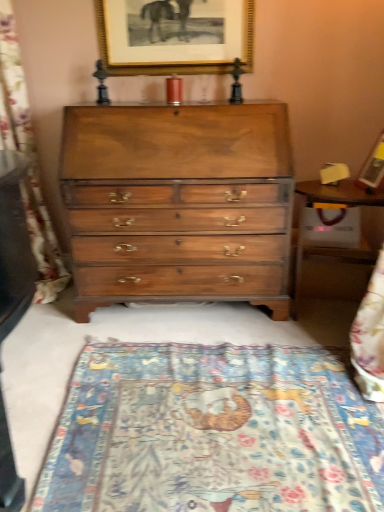
Question: Does wooden table at right appear on the left side of blue woven tapestry at left?

Choices:
 (A) yes
 (B) no

Answer: (B)

Question: Does wooden table at right have a lesser width compared to blue woven tapestry at left?

Choices:
 (A) no
 (B) yes

Answer: (B)

Question: Is wooden table at right taller than blue woven tapestry at left?

Choices:
 (A) no
 (B) yes

Answer: (A)

Question: From a real-world perspective, is wooden table at right located beneath blue woven tapestry at left?

Choices:
 (A) no
 (B) yes

Answer: (B)

Question: Considering the relative sizes of wooden table at right and blue woven tapestry at left in the image provided, is wooden table at right wider than blue woven tapestry at left?

Choices:
 (A) no
 (B) yes

Answer: (A)

Question: Based on their positions, is gold-framed picture at upper center, the first picture frame positioned from the left, located to the left or right of shiny brown wood chest of drawers at center?

Choices:
 (A) right
 (B) left

Answer: (B)

Question: Relative to shiny brown wood chest of drawers at center, is gold-framed picture at upper center, the 2th picture frame when ordered from bottom to top, in front or behind?

Choices:
 (A) behind
 (B) front

Answer: (A)

Question: In terms of width, does gold-framed picture at upper center, the 2th picture frame when ordered from bottom to top, look wider or thinner when compared to shiny brown wood chest of drawers at center?

Choices:
 (A) wide
 (B) thin

Answer: (B)

Question: Is point (233, 23) positioned closer to the camera than point (89, 125)?

Choices:
 (A) farther
 (B) closer

Answer: (A)

Question: Which is correct: wooden picture frame at upper right, which appears as the second picture frame when viewed from the top, is inside blue woven tapestry at left, or outside of it?

Choices:
 (A) outside
 (B) inside

Answer: (A)

Question: Visually, is wooden picture frame at upper right, the second picture frame when ordered from left to right, positioned to the left or to the right of blue woven tapestry at left?

Choices:
 (A) right
 (B) left

Answer: (A)

Question: In terms of height, does wooden picture frame at upper right, which is the 1th picture frame from right to left, look taller or shorter compared to blue woven tapestry at left?

Choices:
 (A) short
 (B) tall

Answer: (A)

Question: From a real-world perspective, is wooden picture frame at upper right, which is the first picture frame from front to back, above or below blue woven tapestry at left?

Choices:
 (A) below
 (B) above

Answer: (B)

Question: In the image, is wooden picture frame at upper right, the second picture frame from the back, positioned in front of or behind gold-framed picture at upper center, the 2th picture frame positioned from the front?

Choices:
 (A) front
 (B) behind

Answer: (A)

Question: Is wooden picture frame at upper right, the second picture frame from the back, bigger or smaller than gold-framed picture at upper center, the 2th picture frame positioned from the front?

Choices:
 (A) big
 (B) small

Answer: (A)